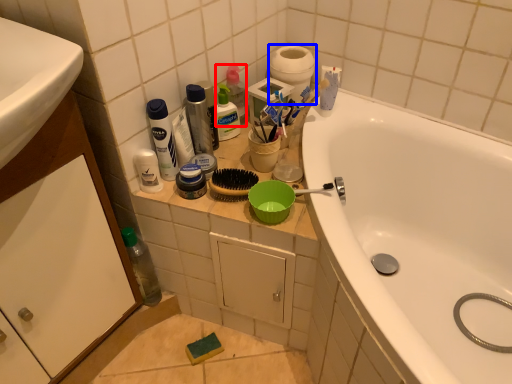
Question: Which point is further to the camera, cleaning product (highlighted by a red box) or toilet paper (highlighted by a blue box)?

Choices:
 (A) cleaning product
 (B) toilet paper

Answer: (B)